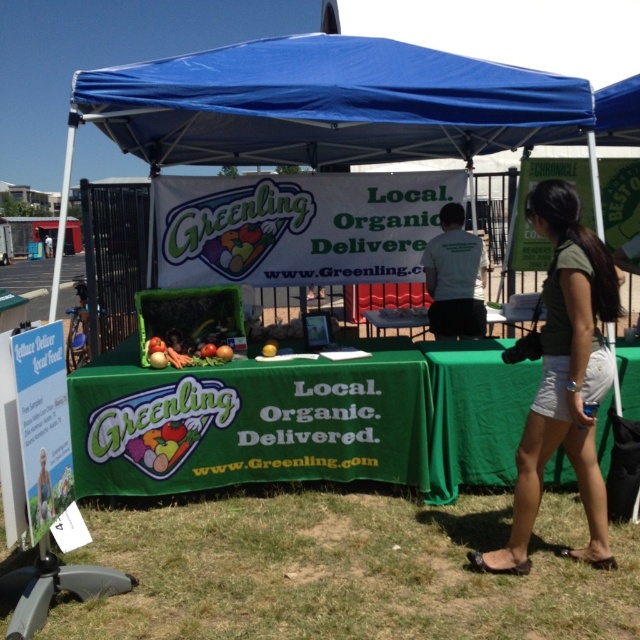
You are a customer at the outdoor market stall. You see the green grass at lower center and the green fabric table at center. Which one is closer to the ground?

The green grass at lower center is closer to the ground as it is positioned below the green fabric table at center.

You are a customer at the market and want to place a large order of vegetables. You need a surface to write your order list. Which object between the green grass at lower center and the green fabric table at center would be more suitable for writing?

The green fabric table at center is more suitable for writing because it has a smaller size compared to the green grass at lower center, making it a stable surface.